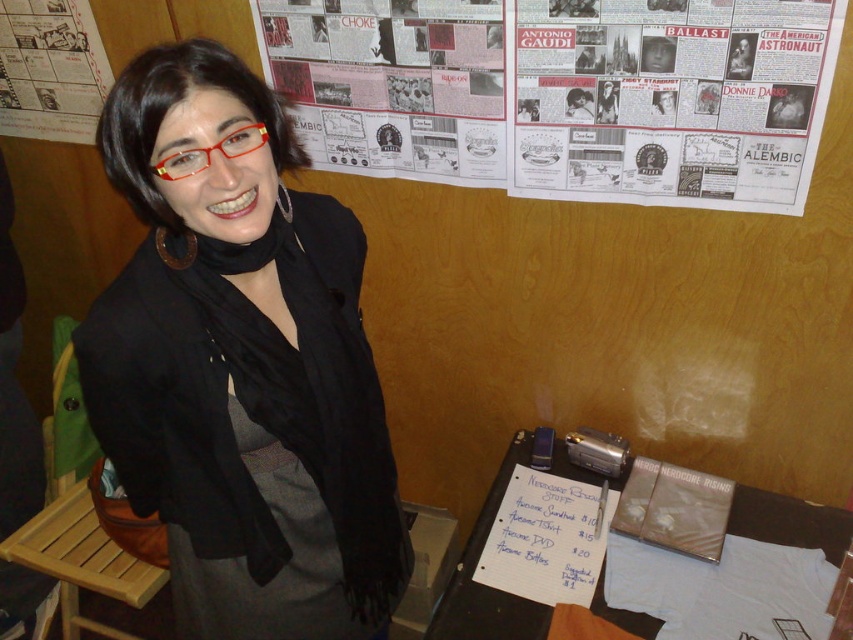
Question: Is white paper posters at upper center behind printed paper poster at upper left?

Choices:
 (A) no
 (B) yes

Answer: (A)

Question: Which object appears farthest from the camera in this image?

Choices:
 (A) printed paper poster at upper left
 (B) white paper posters at upper center
 (C) black matte scarf at center

Answer: (A)

Question: Among these objects, which one is nearest to the camera?

Choices:
 (A) printed paper poster at upper left
 (B) white paper posters at upper center

Answer: (B)

Question: Is white paper posters at upper center positioned before printed paper poster at upper left?

Choices:
 (A) no
 (B) yes

Answer: (B)

Question: Which object is positioned farthest from the printed paper poster at upper left?

Choices:
 (A) white paper posters at upper center
 (B) black matte scarf at center

Answer: (B)

Question: Does black matte scarf at center appear under printed paper poster at upper left?

Choices:
 (A) yes
 (B) no

Answer: (A)